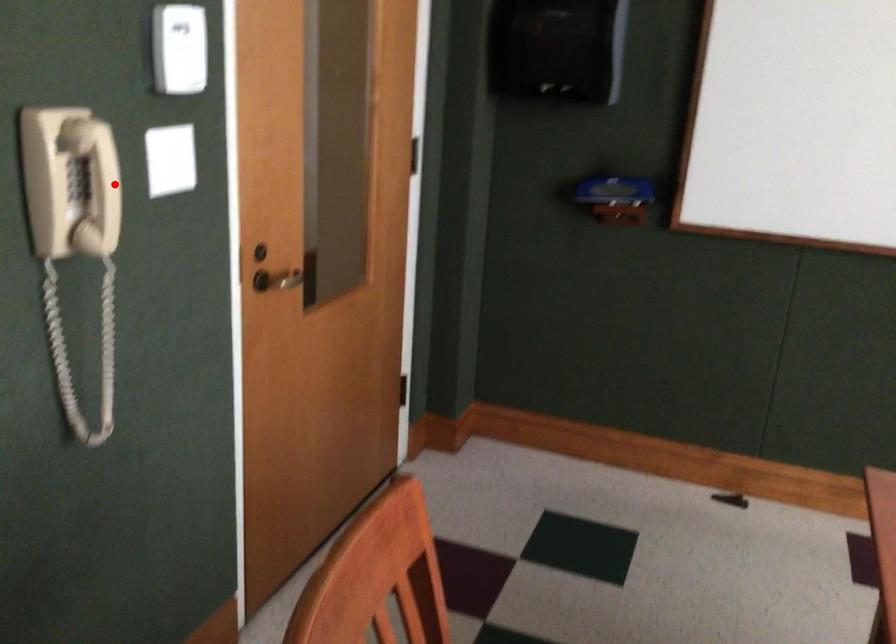
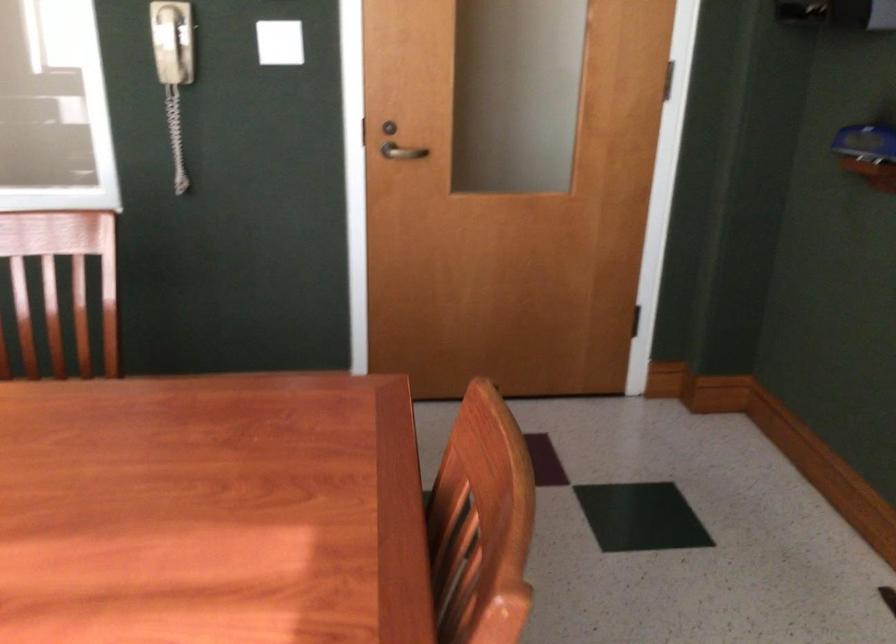
Where in the second image is the point corresponding to the highlighted location from the first image?

(171, 41)